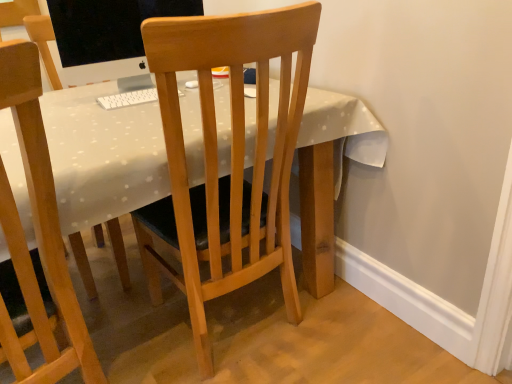
Question: From the image's perspective, relative to light wood chair at center, which is the first chair from right to left, is wooden desk at center above or below?

Choices:
 (A) below
 (B) above

Answer: (A)

Question: Considering the positions of wooden desk at center and light wood chair at center, which is the first chair from right to left, in the image, is wooden desk at center wider or thinner than light wood chair at center, which is the first chair from right to left,?

Choices:
 (A) thin
 (B) wide

Answer: (B)

Question: Which is farther from the light wood chair at center, which appears as the second chair when viewed from the left?

Choices:
 (A) wooden desk at center
 (B) wooden chair at center, placed as the first chair when sorted from left to right
 (C) matte black monitor at upper left

Answer: (C)

Question: Which of these objects is positioned closest to the wooden desk at center?

Choices:
 (A) light wood chair at center, which appears as the second chair when viewed from the left
 (B) matte black monitor at upper left
 (C) wooden chair at center, the 2th chair viewed from the right

Answer: (A)